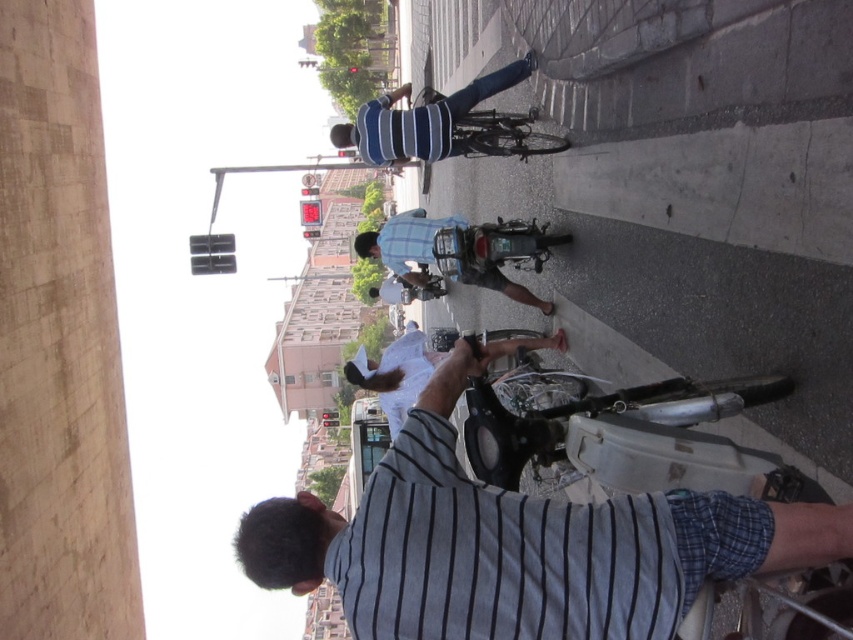
Question: Based on their relative distances, which object is nearer to the shiny black bicycle at center?

Choices:
 (A) white fabric shirt at center
 (B) striped fabric shirt at center
 (C) blue plaid shirt at center

Answer: (B)

Question: Can you confirm if striped fabric shirt at center is smaller than shiny black bicycle at center?

Choices:
 (A) no
 (B) yes

Answer: (A)

Question: Which point is farther to the camera?

Choices:
 (A) striped fabric shirt at center
 (B) white fabric shirt at center

Answer: (A)

Question: In this image, where is blue plaid shirt at center located relative to shiny black bicycle at center?

Choices:
 (A) right
 (B) left

Answer: (B)

Question: Can you confirm if gray striped shirt at center is bigger than blue plaid shirt at center?

Choices:
 (A) yes
 (B) no

Answer: (A)

Question: Which of these objects is positioned closest to the gray striped shirt at center?

Choices:
 (A) blue plaid shirt at center
 (B) shiny black bicycle at center

Answer: (A)